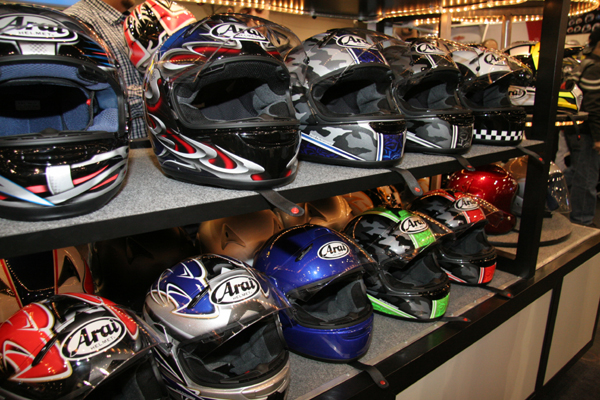
Identify the location of shelf. (398, 347).